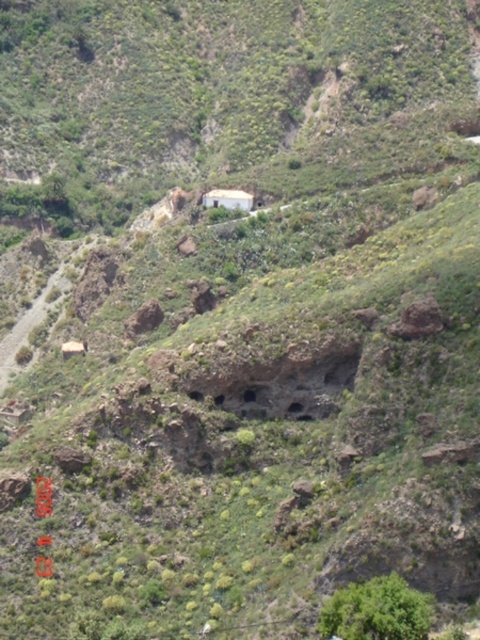
You are standing at the center of the image and want to reach the green leafy bush at lower right. Which direction should you move to get there?

To reach the green leafy bush at lower right, you should move towards the lower right direction since it is located at point (x=376, y=611).

You are a hiker who wants to take a photo of the white matte hut at center without the green leafy bush at lower right blocking the view. Which direction should you move to ensure the bush is no longer in front of the hut?

The green leafy bush at lower right is in front of the white matte hut at center. To avoid the bush blocking the view, move to the left or right side so that the bush is no longer between you and the hut.